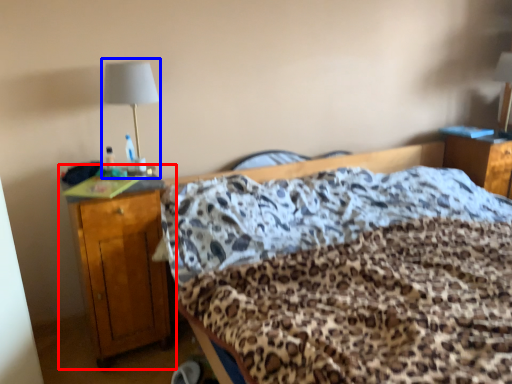
Question: Which of the following is the closest to the observer, nightstand (highlighted by a red box) or bedside lamp (highlighted by a blue box)?

Choices:
 (A) nightstand
 (B) bedside lamp

Answer: (A)